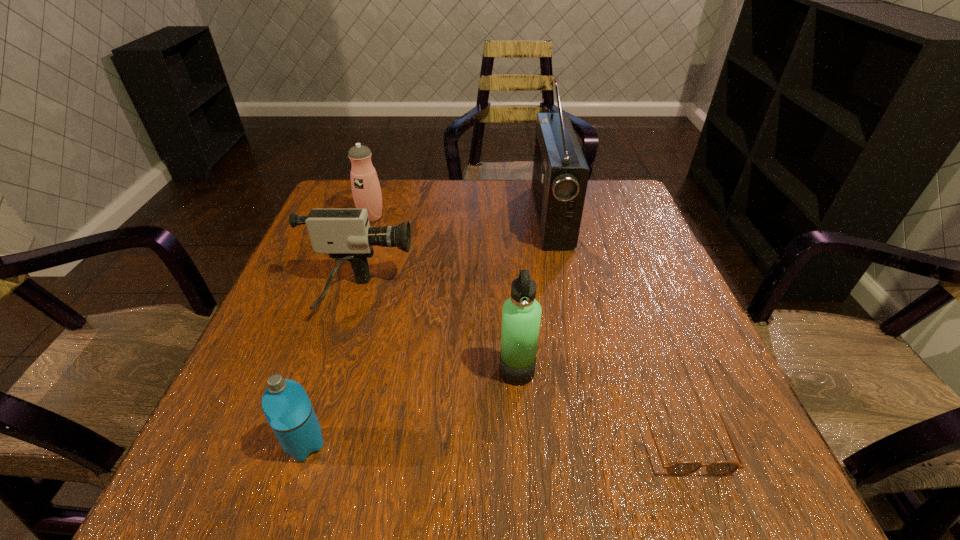
This screenshot has width=960, height=540. I want to click on radio receiver, so click(560, 175).

I want to click on the tallest object, so click(x=560, y=175).

I want to click on the second nearest thermos bottle, so click(x=521, y=314).

Find the location of a particular element. Image resolution: width=960 pixels, height=540 pixels. the fourth object from left to right is located at coordinates (521, 314).

What are the coordinates of `the farthest thermos bottle` in the screenshot? It's located at (366, 190).

Where is `camcorder`? The width and height of the screenshot is (960, 540). camcorder is located at coordinates (345, 234).

Where is `the shortest thermos bottle`? the shortest thermos bottle is located at coordinates (286, 405).

Identify the location of the shortest object. The height and width of the screenshot is (540, 960). (681, 468).

Locate an element on the screen. The image size is (960, 540). sunglasses is located at coordinates click(x=681, y=468).

This screenshot has height=540, width=960. I want to click on vacant space located 0.320m on the front-facing side of the fifth object from left to right, so click(x=414, y=215).